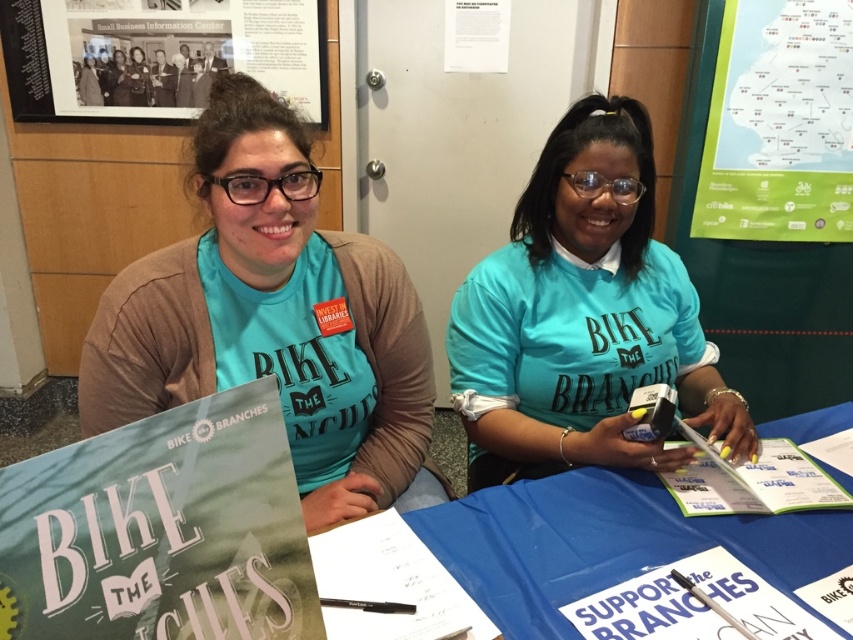
Between point (650, 243) and point (282, 70), which one is positioned in front?

Point (650, 243) is in front.

From the picture: Who is positioned more to the right, teal matte shirt at center or black paper at upper left?

Answer: From the viewer's perspective, teal matte shirt at center appears more on the right side.

Is point (552, 416) in front of point (231, 33)?

Yes, it is in front of point (231, 33).

Locate an element on the screen. This screenshot has width=853, height=640. teal matte shirt at center is located at coordinates (582, 316).

Is point (485, 380) closer to camera compared to point (674, 588)?

No, (485, 380) is further to viewer.

Is point (477, 324) positioned after point (674, 634)?

Yes, it is.

You are a GUI agent. You are given a task and a screenshot of the screen. Output one action in this format:
    pyautogui.click(x=<x>, y=<y>)
    Task: Click on the teal matte shirt at center
    
    Given the screenshot: What is the action you would take?
    click(582, 316)

Does teal matte shirt at center appear under green paper map at upper right?

Correct, teal matte shirt at center is located below green paper map at upper right.

Does teal matte shirt at center have a larger size compared to green paper map at upper right?

Yes, teal matte shirt at center is bigger than green paper map at upper right.

Between point (628, 180) and point (831, 180), which one is positioned behind?

The point (831, 180) is behind.

Identify the location of teal matte shirt at center. Image resolution: width=853 pixels, height=640 pixels. (582, 316).